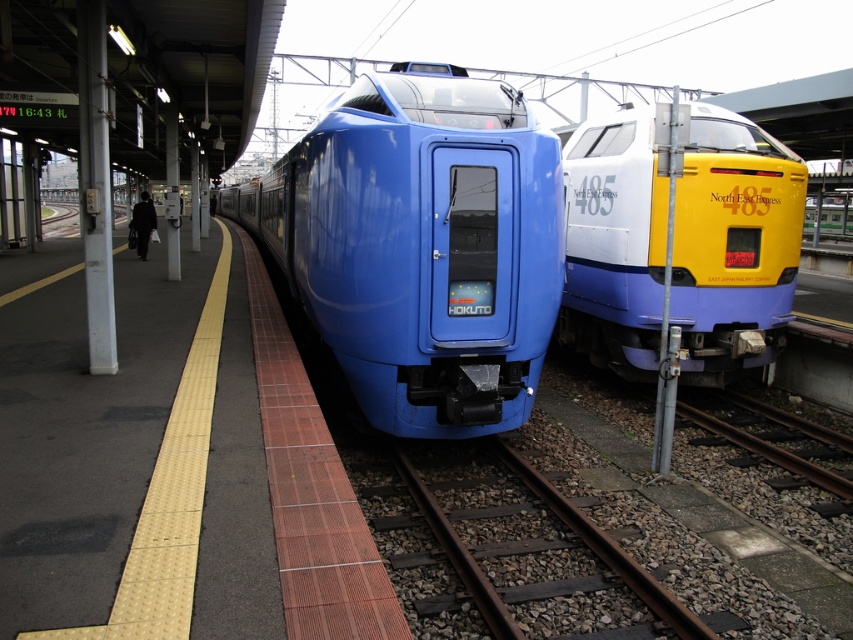
Is rusty metal train track at center shorter than black fabric bag at left?

Yes, rusty metal train track at center is shorter than black fabric bag at left.

Can you confirm if rusty metal train track at center is taller than black fabric bag at left?

Incorrect, rusty metal train track at center's height is not larger of black fabric bag at left's.

Image resolution: width=853 pixels, height=640 pixels. In order to click on rusty metal train track at center in this screenshot , I will do `click(607, 548)`.

Can you confirm if matte blue train at center is bigger than yellow/white glossy train at right?

Yes, matte blue train at center is bigger than yellow/white glossy train at right.

Can you confirm if matte blue train at center is thinner than yellow/white glossy train at right?

No, matte blue train at center is not thinner than yellow/white glossy train at right.

This screenshot has height=640, width=853. Describe the element at coordinates (421, 246) in the screenshot. I see `matte blue train at center` at that location.

At what (x,y) coordinates should I click in order to perform the action: click on matte blue train at center. Please return your answer as a coordinate pair (x, y). Looking at the image, I should click on click(x=421, y=246).

Can you confirm if smooth metal track at lower right is bigger than black fabric bag at left?

No, smooth metal track at lower right is not bigger than black fabric bag at left.

Which is more to the right, smooth metal track at lower right or black fabric bag at left?

smooth metal track at lower right

Does point (776, 458) lie in front of point (131, 218)?

Yes, it is.

Where is `smooth metal track at lower right`? This screenshot has width=853, height=640. smooth metal track at lower right is located at coordinates (769, 451).